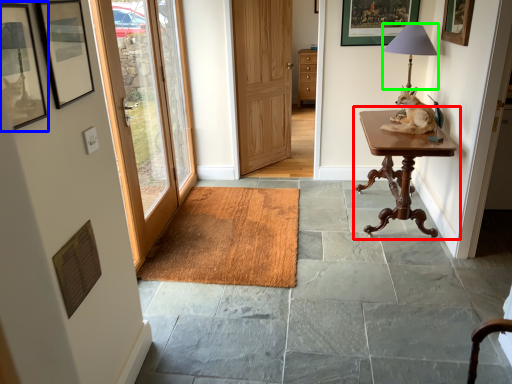
Question: Which object is positioned farthest from table (highlighted by a red box)? Select from picture frame (highlighted by a blue box) and table lamp (highlighted by a green box).

Choices:
 (A) picture frame
 (B) table lamp

Answer: (A)